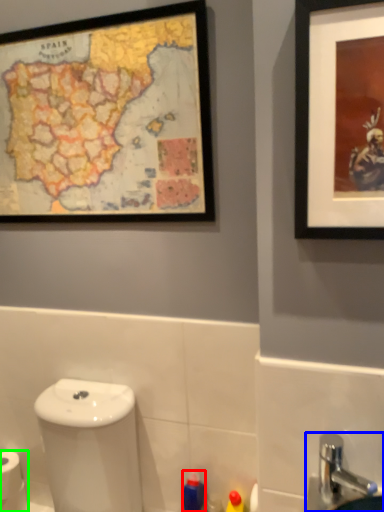
Question: Based on their relative distances, which object is farther from toiletry (highlighted by a red box)? Choose from sink (highlighted by a blue box) and toilet paper (highlighted by a green box).

Choices:
 (A) sink
 (B) toilet paper

Answer: (B)